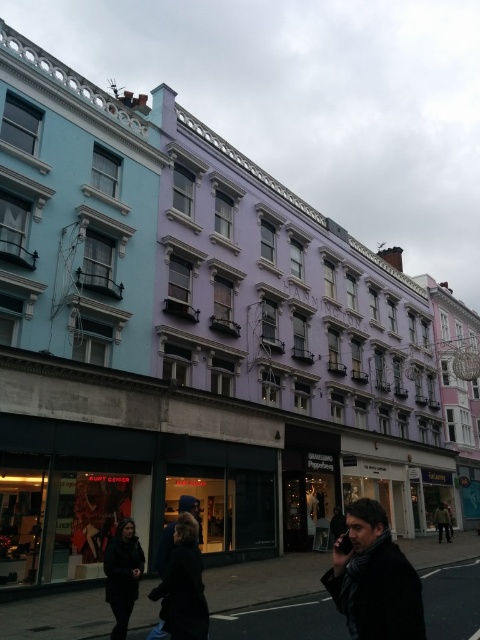
Question: Is dark blue jacket at lower center thinner than dark gray scarf at center?

Choices:
 (A) yes
 (B) no

Answer: (A)

Question: Which object appears farthest from the camera in this image?

Choices:
 (A) dark gray wool scarf at lower right
 (B) dark blue jacket at lower center

Answer: (B)

Question: Is dark gray wool scarf at lower right thinner than dark gray scarf at center?

Choices:
 (A) no
 (B) yes

Answer: (A)

Question: Which point appears closest to the camera in this image?

Choices:
 (A) (443, 515)
 (B) (131, 538)
 (C) (392, 579)

Answer: (C)

Question: Does dark gray wool scarf at lower right have a greater width compared to dark blue jacket at lower center?

Choices:
 (A) yes
 (B) no

Answer: (A)

Question: Which is farther from the dark blue jacket at lower center?

Choices:
 (A) dark gray wool scarf at lower right
 (B) dark gray scarf at center

Answer: (B)